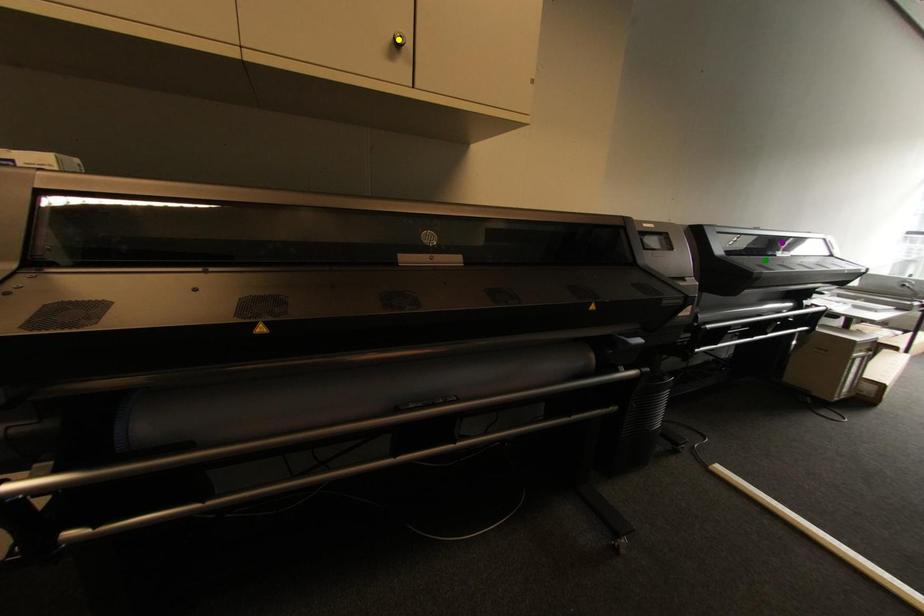
Order these from nearest to farthest:
A) yellow point
B) green point
C) purple point

yellow point → green point → purple point